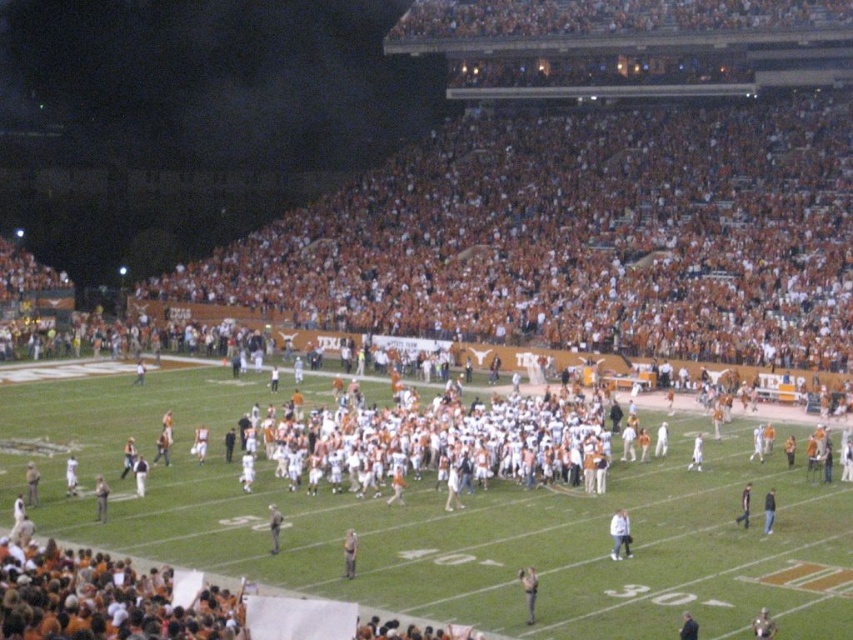
Question: Which point is farther from the camera taking this photo?

Choices:
 (A) click(763, 513)
 (B) click(697, 464)

Answer: (B)

Question: Which object appears closest to the camera in this image?

Choices:
 (A) light brown leather jacket at lower left
 (B) dark gray fabric jacket at lower right

Answer: (B)

Question: Which is farther from the white cotton shirt at center?

Choices:
 (A) light brown leather jacket at center
 (B) white fabric person at center
 (C) white fabric jacket at center

Answer: (B)

Question: Does white fabric jacket at center have a greater width compared to white fabric person at center?

Choices:
 (A) yes
 (B) no

Answer: (A)

Question: Does white cotton shirt at center appear on the left side of light brown leather jacket at lower left?

Choices:
 (A) yes
 (B) no

Answer: (B)

Question: Is white fabric jacket at center wider than white fabric jersey at center?

Choices:
 (A) yes
 (B) no

Answer: (A)